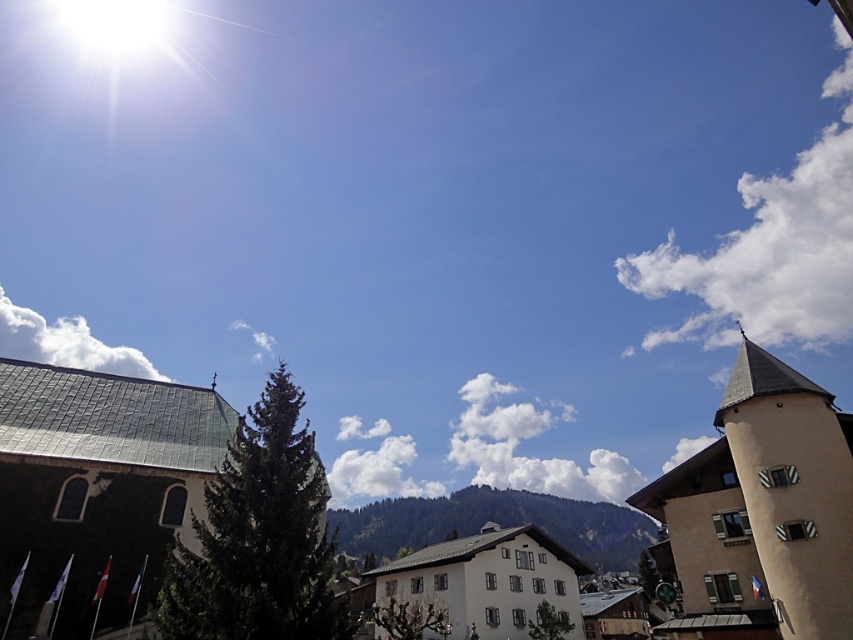
You are an architect designing a new building that needs to be narrower than the white fluffy cloud at upper left. Can the smooth stone building at center serve as a reference for the width of your new building?

Yes, the smooth stone building at center has a width less than the white fluffy cloud at upper left, so it can serve as a reference for your new building.

Based on the photo, you are an architect analyzing the scene. You need to determine if the beige stone tower at right can be seen from the ground level without obstruction from the white fluffy cloud at upper left. Based on their heights, what is your conclusion?

The beige stone tower at right has a lesser height compared to the white fluffy cloud at upper left. Since the cloud is higher, it might block the view of the tower from certain angles, but since the tower is on the ground and the cloud is in the sky, the tower would still be visible from the ground level. However, the cloud could partially obscure the tower if they are aligned in the same line of sight.